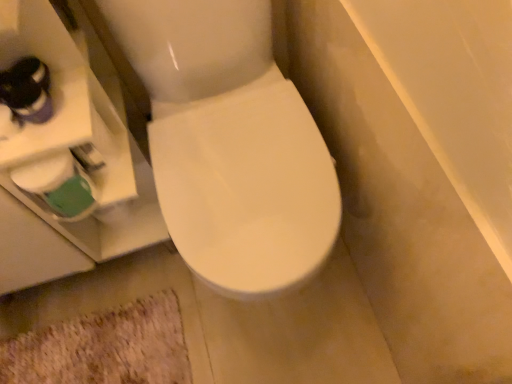
Question: From a real-world perspective, relative to beige shaggy bath mat at lower left, is white matte toilet paper at lower left vertically above or below?

Choices:
 (A) above
 (B) below

Answer: (A)

Question: Is white matte toilet paper at lower left inside the boundaries of beige shaggy bath mat at lower left, or outside?

Choices:
 (A) outside
 (B) inside

Answer: (A)

Question: Relative to beige shaggy bath mat at lower left, is white matte toilet paper at lower left in front or behind?

Choices:
 (A) behind
 (B) front

Answer: (B)

Question: Considering the positions of beige shaggy bath mat at lower left and white matte toilet paper at lower left in the image, is beige shaggy bath mat at lower left taller or shorter than white matte toilet paper at lower left?

Choices:
 (A) tall
 (B) short

Answer: (B)

Question: Looking at their shapes, would you say beige shaggy bath mat at lower left is wider or thinner than white matte toilet paper at lower left?

Choices:
 (A) thin
 (B) wide

Answer: (B)

Question: In terms of size, does beige shaggy bath mat at lower left appear bigger or smaller than white matte toilet paper at lower left?

Choices:
 (A) big
 (B) small

Answer: (A)

Question: From a real-world perspective, is beige shaggy bath mat at lower left above or below white matte toilet paper at lower left?

Choices:
 (A) above
 (B) below

Answer: (B)